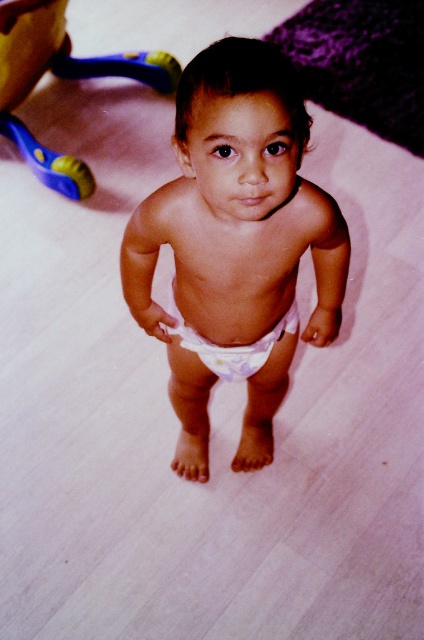
Question: Among these objects, which one is farthest from the camera?

Choices:
 (A) white fabric diaper at center
 (B) blue plastic walker at upper left

Answer: (B)

Question: Considering the relative positions of blue plastic walker at upper left and white fabric diaper at center in the image provided, where is blue plastic walker at upper left located with respect to white fabric diaper at center?

Choices:
 (A) below
 (B) above

Answer: (B)

Question: Which object is positioned closest to the white cloth diaper at center?

Choices:
 (A) blue plastic walker at upper left
 (B) white fabric diaper at center

Answer: (B)

Question: Does blue plastic walker at upper left have a greater width compared to white fabric diaper at center?

Choices:
 (A) no
 (B) yes

Answer: (B)

Question: Which point is farther to the camera?

Choices:
 (A) white fabric diaper at center
 (B) white cloth diaper at center

Answer: (A)

Question: Is blue plastic walker at upper left further to the viewer compared to white fabric diaper at center?

Choices:
 (A) yes
 (B) no

Answer: (A)